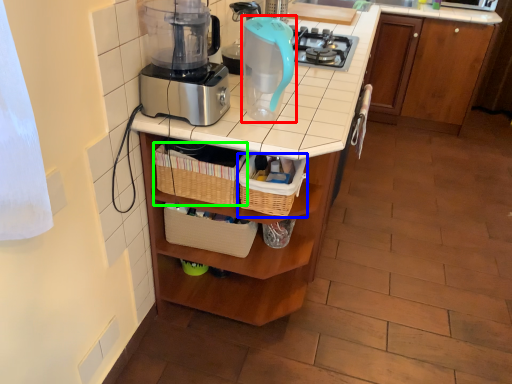
Question: Estimate the real-world distances between objects in this image. Which object is closer to kitchen appliance (highlighted by a red box), basket (highlighted by a blue box) or basket (highlighted by a green box)?

Choices:
 (A) basket
 (B) basket

Answer: (A)